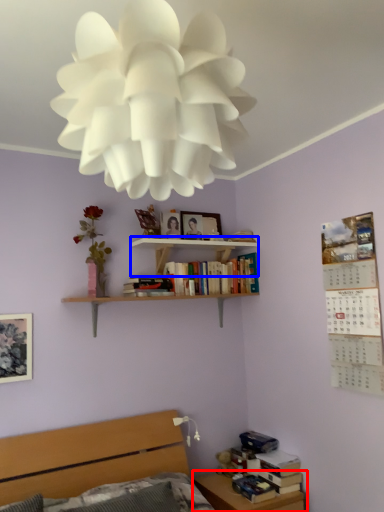
Question: Which object is further to the camera taking this photo, table (highlighted by a red box) or shelf (highlighted by a blue box)?

Choices:
 (A) table
 (B) shelf

Answer: (B)